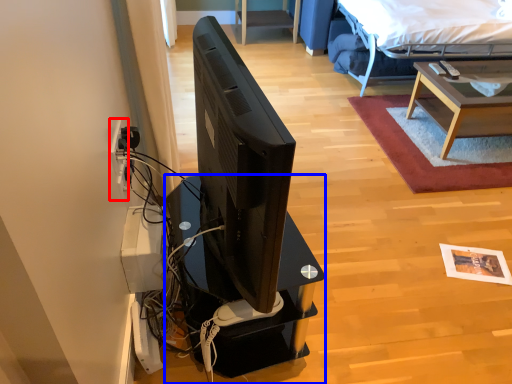
Question: Among these objects, which one is nearest to the camera, electric outlet (highlighted by a red box) or desk (highlighted by a blue box)?

Choices:
 (A) electric outlet
 (B) desk

Answer: (B)